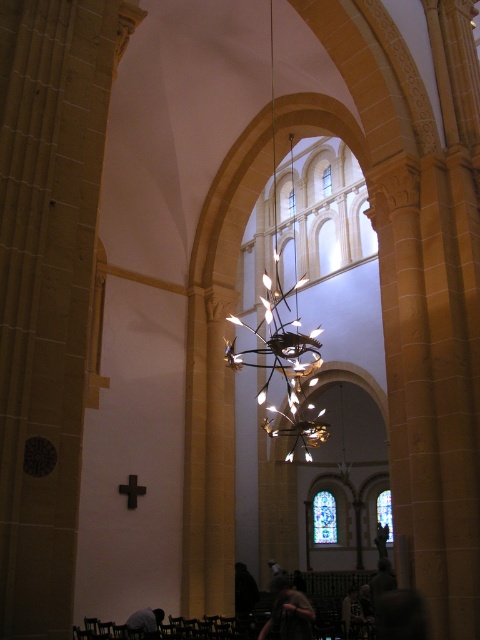
Question: Can you confirm if dark brown leather jacket at lower center is wider than dark gray fabric at lower center?

Choices:
 (A) yes
 (B) no

Answer: (A)

Question: Can you confirm if dark brown leather jacket at lower center is positioned to the left of dark gray fabric at lower center?

Choices:
 (A) yes
 (B) no

Answer: (B)

Question: Does dark brown leather jacket at lower center appear over dark gray fabric at lower center?

Choices:
 (A) no
 (B) yes

Answer: (A)